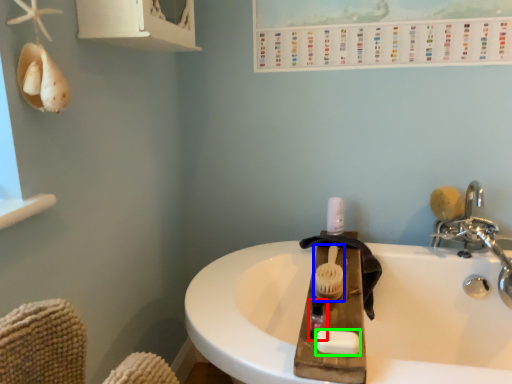
Question: Which is farther away from mouthwash (highlighted by a red box)? brush (highlighted by a blue box) or soap (highlighted by a green box)?

Choices:
 (A) brush
 (B) soap

Answer: (A)